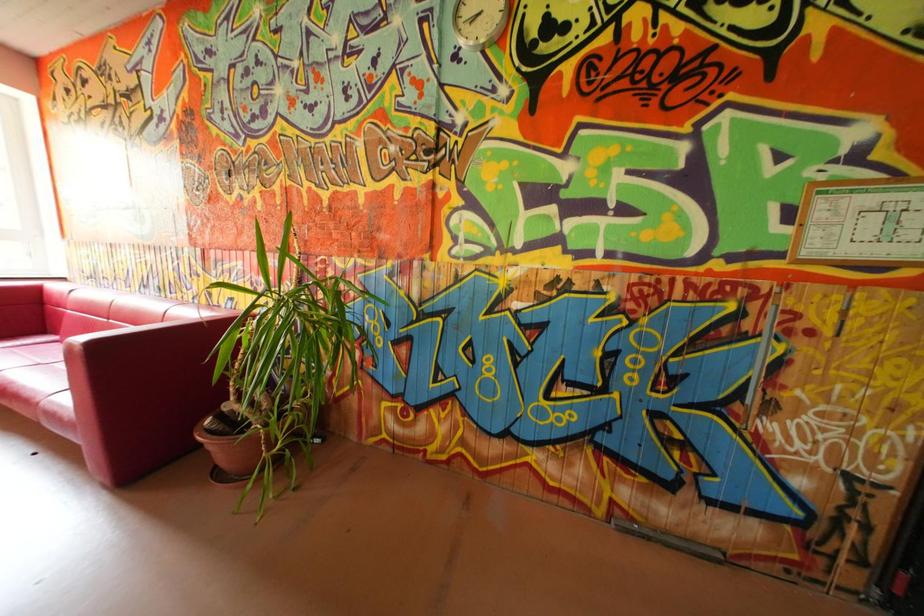
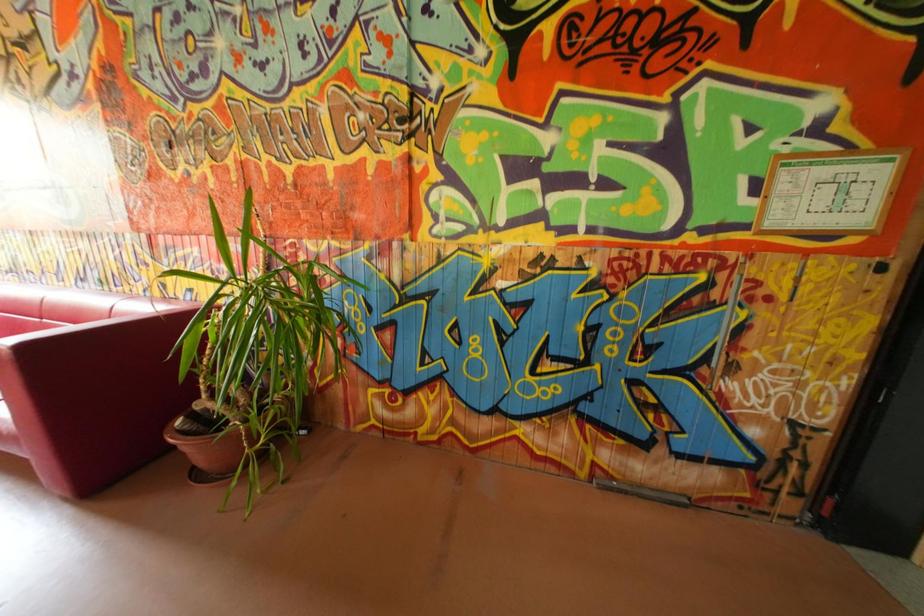
Question: The images are taken continuously from a first-person perspective. In which direction is your viewpoint rotating?

Choices:
 (A) Left
 (B) Right
 (C) Up
 (D) Down

Answer: (B)